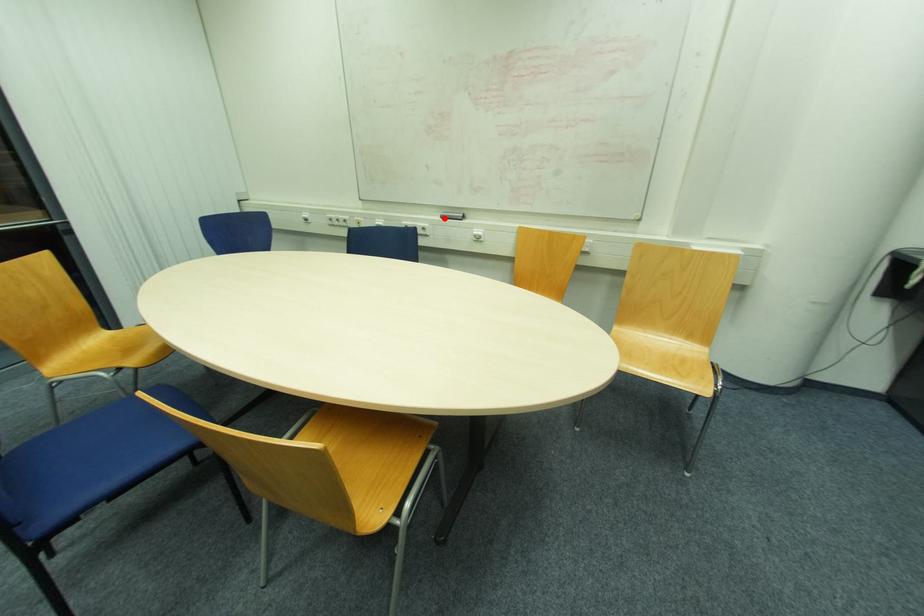
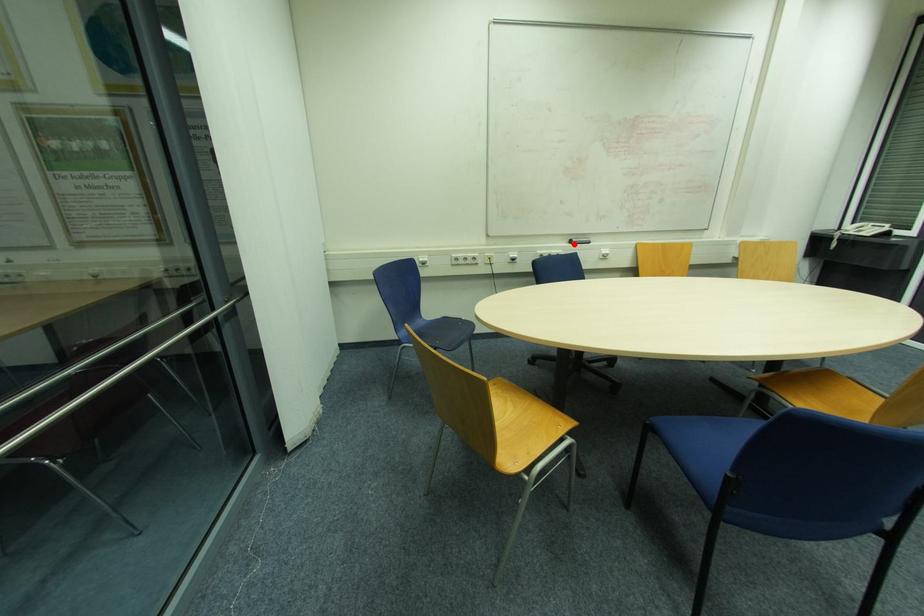
I am providing you with two images of the same scene from different viewpoints. A red point is marked on the first image and another point is marked on the second image. Do the highlighted points in image1 and image2 indicate the same real-world spot?

Yes